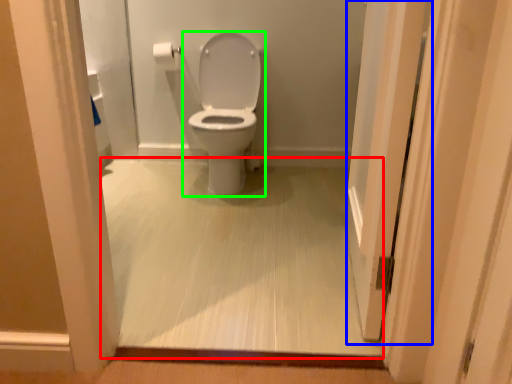
Question: Considering the real-world distances, which object is farthest from corridor (highlighted by a red box)? screen door (highlighted by a blue box) or toilet (highlighted by a green box)?

Choices:
 (A) screen door
 (B) toilet

Answer: (B)